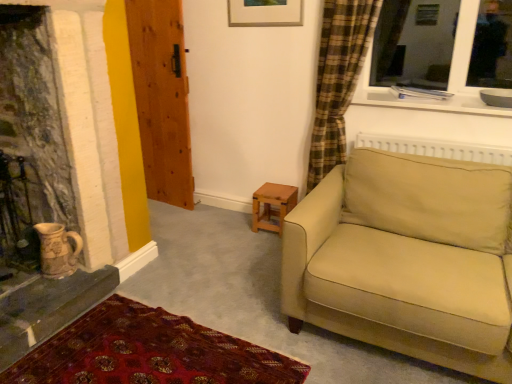
Image resolution: width=512 pixels, height=384 pixels. Find the location of `free location to the left of wooden table at center`. free location to the left of wooden table at center is located at coordinates (241, 224).